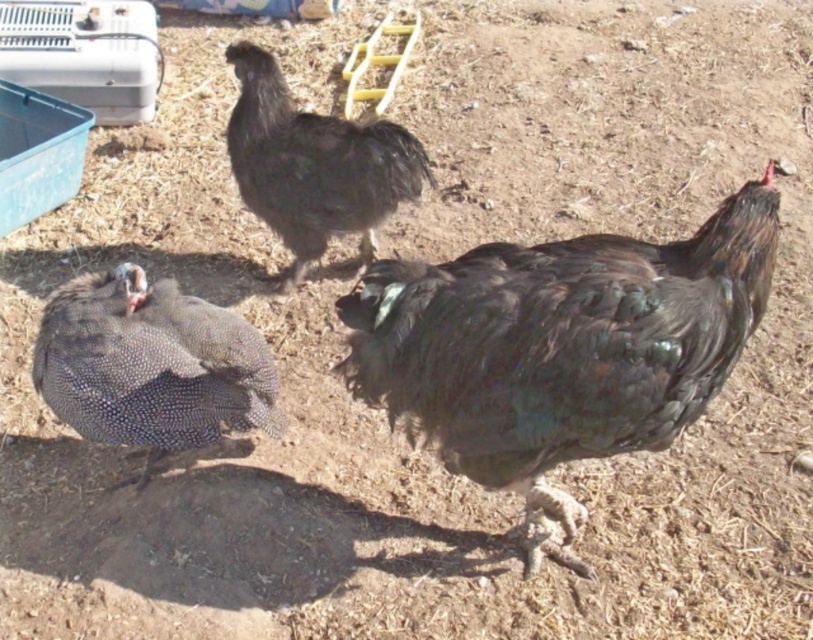
Is shiny black feathers at center thinner than speckled feathered guinea fowl at lower left?

In fact, shiny black feathers at center might be wider than speckled feathered guinea fowl at lower left.

Is point (383, 385) positioned behind point (177, 307)?

No, (383, 385) is closer to viewer.

You are a GUI agent. You are given a task and a screenshot of the screen. Output one action in this format:
    pyautogui.click(x=<x>, y=<y>)
    Task: Click on the shiny black feathers at center
    This screenshot has width=813, height=640.
    Given the screenshot: What is the action you would take?
    pyautogui.click(x=561, y=348)

Is shiny black feathers at center to the left of black feathered chicken at center from the viewer's perspective?

Incorrect, shiny black feathers at center is not on the left side of black feathered chicken at center.

Is shiny black feathers at center to the right of black feathered chicken at center from the viewer's perspective?

Correct, you'll find shiny black feathers at center to the right of black feathered chicken at center.

Describe the element at coordinates (561, 348) in the screenshot. I see `shiny black feathers at center` at that location.

You are a GUI agent. You are given a task and a screenshot of the screen. Output one action in this format:
    pyautogui.click(x=<x>, y=<y>)
    Task: Click on the shiny black feathers at center
    The width and height of the screenshot is (813, 640).
    Given the screenshot: What is the action you would take?
    pyautogui.click(x=561, y=348)

Which is more to the left, speckled feathered guinea fowl at lower left or black feathered chicken at center?

speckled feathered guinea fowl at lower left

Is the position of speckled feathered guinea fowl at lower left less distant than that of black feathered chicken at center?

Yes, it is in front of black feathered chicken at center.

Measure the distance between point (66, 352) and camera.

Point (66, 352) is 2.43 meters away from camera.

Identify the location of speckled feathered guinea fowl at lower left. The width and height of the screenshot is (813, 640). (150, 365).